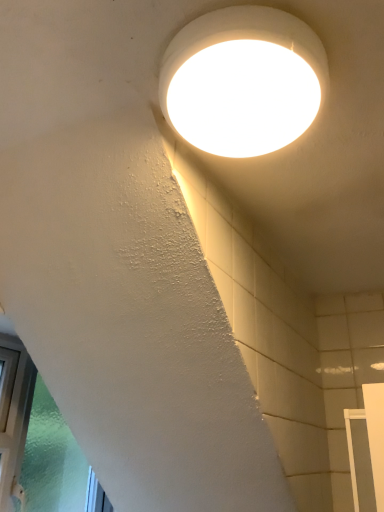
Question: Would you say white glossy light fixture at upper center contains green frosted glass at lower left?

Choices:
 (A) yes
 (B) no

Answer: (B)

Question: Does white glossy light fixture at upper center have a larger size compared to green frosted glass at lower left?

Choices:
 (A) yes
 (B) no

Answer: (B)

Question: Is white glossy light fixture at upper center next to green frosted glass at lower left and touching it?

Choices:
 (A) no
 (B) yes

Answer: (A)

Question: Are white glossy light fixture at upper center and green frosted glass at lower left located far from each other?

Choices:
 (A) yes
 (B) no

Answer: (A)

Question: Does white glossy light fixture at upper center come in front of green frosted glass at lower left?

Choices:
 (A) no
 (B) yes

Answer: (B)

Question: Can you confirm if white glossy light fixture at upper center is wider than green frosted glass at lower left?

Choices:
 (A) yes
 (B) no

Answer: (A)

Question: Is green frosted glass at lower left facing towards white glossy light fixture at upper center?

Choices:
 (A) yes
 (B) no

Answer: (A)

Question: From the image's perspective, is green frosted glass at lower left below white glossy light fixture at upper center?

Choices:
 (A) yes
 (B) no

Answer: (A)

Question: Is green frosted glass at lower left behind white glossy light fixture at upper center?

Choices:
 (A) yes
 (B) no

Answer: (A)

Question: Can you confirm if green frosted glass at lower left is thinner than white glossy light fixture at upper center?

Choices:
 (A) yes
 (B) no

Answer: (A)

Question: Does green frosted glass at lower left appear on the right side of white glossy light fixture at upper center?

Choices:
 (A) yes
 (B) no

Answer: (B)

Question: Is green frosted glass at lower left directly adjacent to white glossy light fixture at upper center?

Choices:
 (A) no
 (B) yes

Answer: (A)

Question: Based on their positions, is green frosted glass at lower left located to the left or right of white glossy light fixture at upper center?

Choices:
 (A) right
 (B) left

Answer: (B)